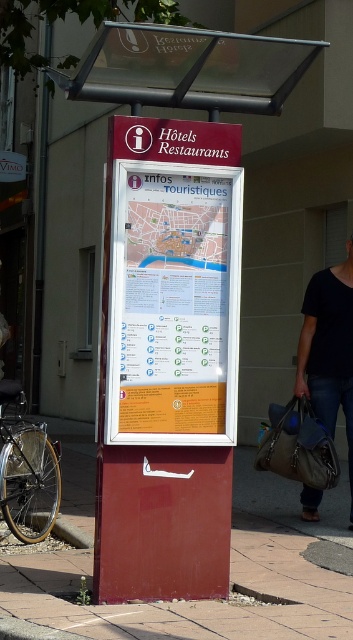
Can you confirm if matte plastic signboard at center is positioned above white paper poster at center?

No, matte plastic signboard at center is not above white paper poster at center.

Who is lower down, matte plastic signboard at center or white paper poster at center?

matte plastic signboard at center is below.

Where is `matte plastic signboard at center`? This screenshot has height=640, width=353. matte plastic signboard at center is located at coordinates (171, 298).

Is smooth concrete pavement at lower center closer to the viewer compared to black leather bag at lower right?

Yes, it is.

Where is `smooth concrete pavement at lower center`? The image size is (353, 640). smooth concrete pavement at lower center is located at coordinates (204, 600).

Between point (4, 595) and point (319, 289), which one is positioned in front?

Point (4, 595) is in front.

Identify the location of smooth concrete pavement at lower center. The width and height of the screenshot is (353, 640). click(204, 600).

Can you confirm if matte plastic signboard at center is bigger than smooth concrete pavement at lower center?

Yes, matte plastic signboard at center is bigger than smooth concrete pavement at lower center.

Between point (276, 97) and point (198, 637), which one is positioned behind?

Point (276, 97)

Who is more forward, (182, 156) or (223, 618)?

Point (223, 618)

You are a GUI agent. You are given a task and a screenshot of the screen. Output one action in this format:
    pyautogui.click(x=<x>, y=<y>)
    Task: Click on the matte plastic signboard at center
    Image resolution: width=353 pixels, height=640 pixels.
    Given the screenshot: What is the action you would take?
    pyautogui.click(x=171, y=298)